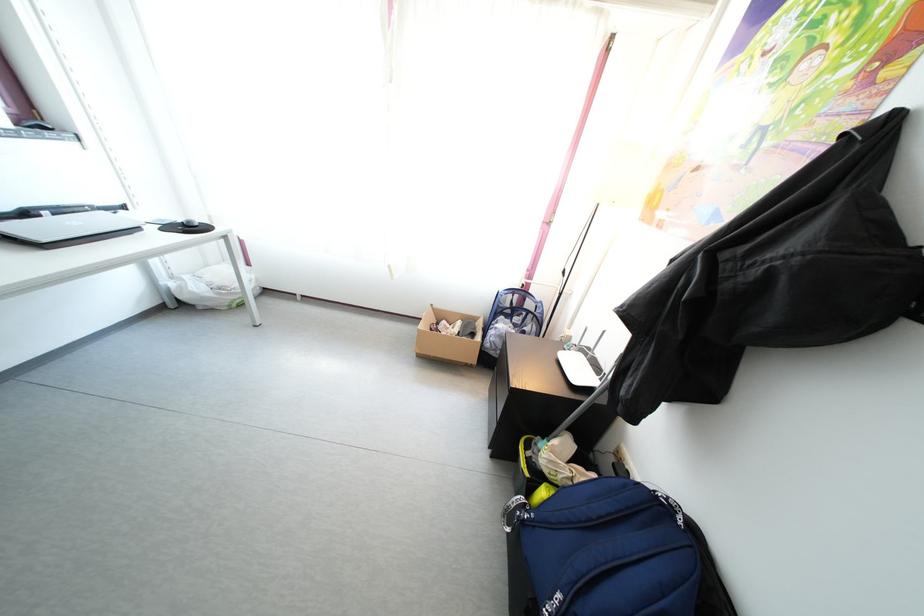
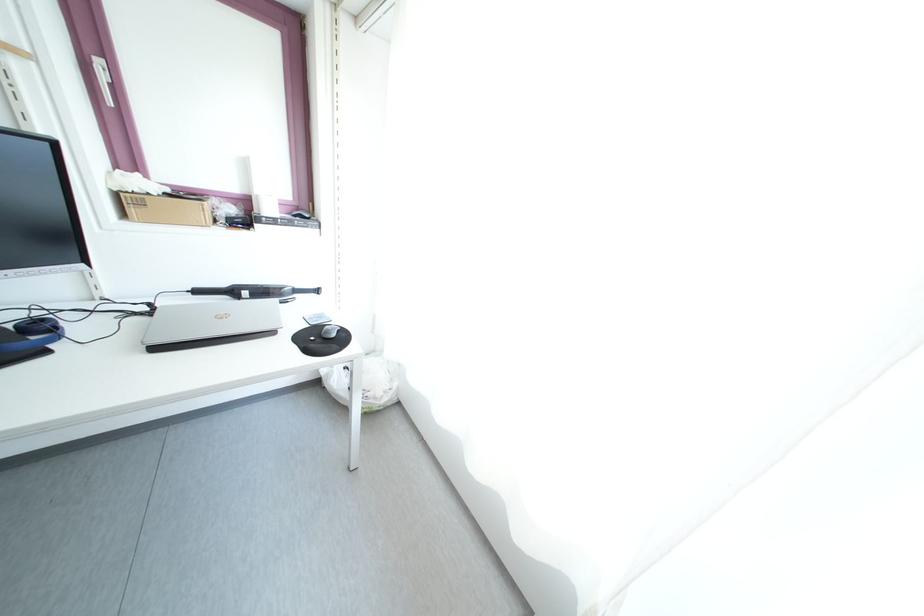
Find the pixel in the second image that matches (x=54, y=222) in the first image.

(251, 302)